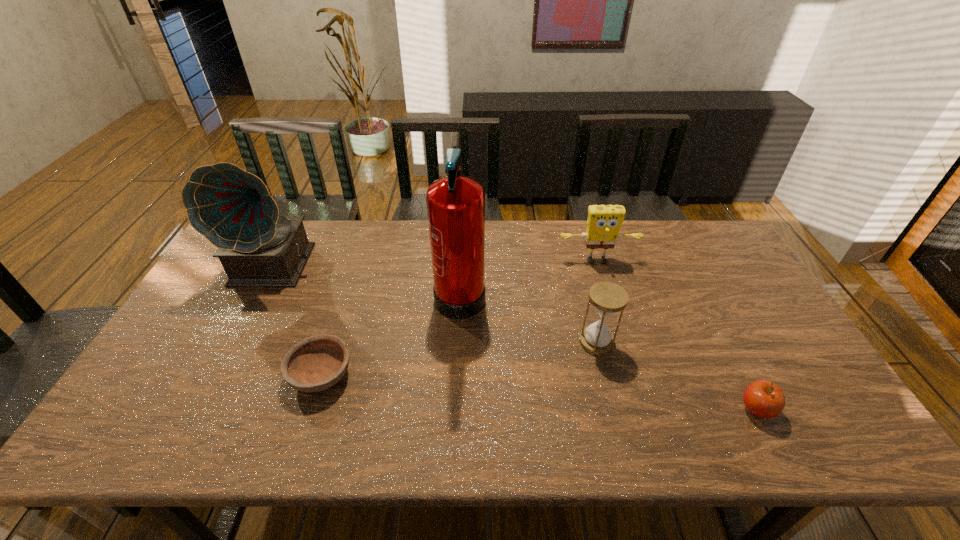
You are a GUI agent. You are given a task and a screenshot of the screen. Output one action in this format:
    pyautogui.click(x=<x>, y=<y>)
    Task: Click on the tallest object
    The width and height of the screenshot is (960, 540).
    Given the screenshot: What is the action you would take?
    pyautogui.click(x=455, y=204)

At what (x,y) coordinates should I click in order to perform the action: click on the fourth object from right to left. Please return your answer as a coordinate pair (x, y). Looking at the image, I should click on (455, 204).

Find the location of `the second tallest object`. the second tallest object is located at coordinates (233, 209).

Where is `the leftmost object`? The height and width of the screenshot is (540, 960). the leftmost object is located at coordinates (233, 209).

This screenshot has width=960, height=540. What are the coordinates of `sponge` in the screenshot? It's located at (604, 222).

At what (x,y) coordinates should I click in order to perform the action: click on hourglass. Please return your answer as a coordinate pair (x, y). This screenshot has width=960, height=540. Looking at the image, I should click on (607, 298).

Locate an element on the screen. the second shortest object is located at coordinates click(764, 399).

This screenshot has width=960, height=540. What are the coordinates of `the rightmost object` in the screenshot? It's located at (764, 399).

In order to click on the shortest object in this screenshot , I will do `click(317, 363)`.

I want to click on bowl, so click(317, 363).